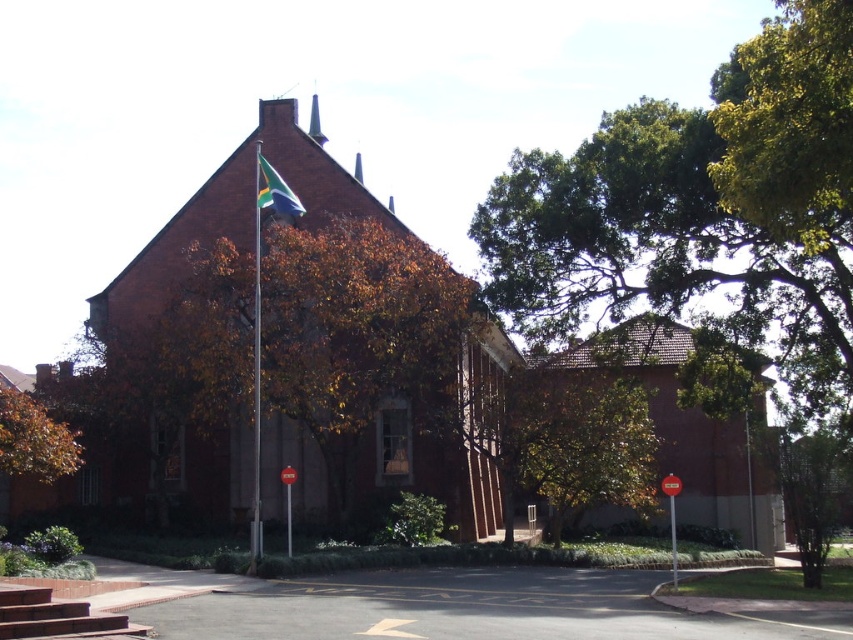
Question: Is metallic flag pole at upper center closer to camera compared to blue-green fabric flag at upper center?

Choices:
 (A) yes
 (B) no

Answer: (A)

Question: Observing the image, what is the correct spatial positioning of green leafy tree at center in reference to blue-green fabric flag at upper center?

Choices:
 (A) above
 (B) below

Answer: (B)

Question: Can you confirm if green leafy tree at center is positioned to the right of metallic flag pole at upper center?

Choices:
 (A) yes
 (B) no

Answer: (A)

Question: Which of the following is the closest to the observer?

Choices:
 (A) metallic flag pole at upper center
 (B) blue-green fabric flag at upper center

Answer: (A)

Question: Estimate the real-world distances between objects in this image. Which object is closer to the green leafy tree at center?

Choices:
 (A) brown leafy tree at lower left
 (B) blue-green fabric flag at upper center
 (C) brown leafy tree at center
 (D) metallic flag pole at upper center

Answer: (C)

Question: Estimate the real-world distances between objects in this image. Which object is closer to the blue-green fabric flag at upper center?

Choices:
 (A) metallic flag pole at upper center
 (B) brown leafy tree at center
 (C) green leafy tree at center
 (D) brown leafy tree at lower left

Answer: (A)